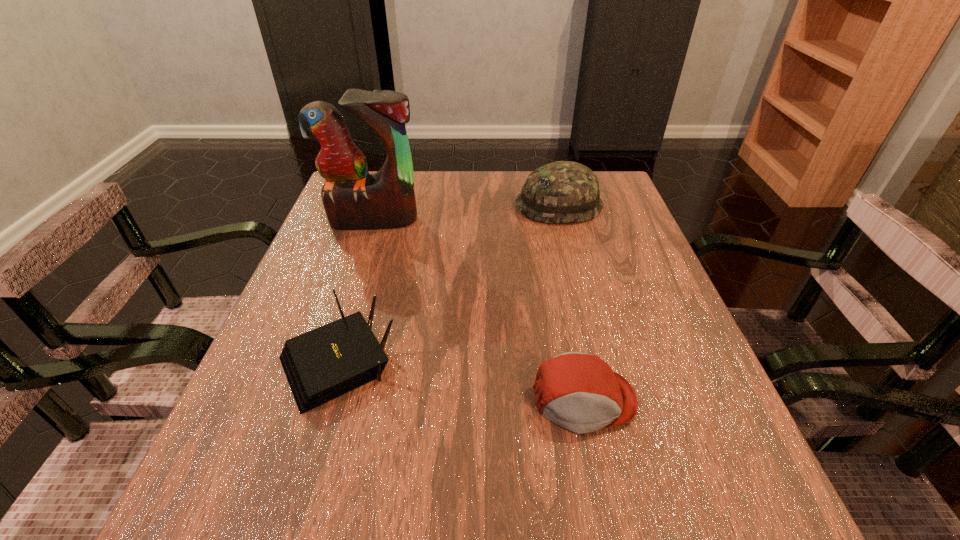
You are a GUI agent. You are given a task and a screenshot of the screen. Output one action in this format:
    pyautogui.click(x=<x>, y=<y>)
    Task: Click on the headwear present at the far edge
    Image resolution: width=960 pixels, height=540 pixels.
    Given the screenshot: What is the action you would take?
    pyautogui.click(x=564, y=191)

Locate an element on the screen. The width and height of the screenshot is (960, 540). parrot present at the left edge is located at coordinates (353, 199).

You are a GUI agent. You are given a task and a screenshot of the screen. Output one action in this format:
    pyautogui.click(x=<x>, y=<y>)
    Task: Click on the router that is at the left edge
    
    Given the screenshot: What is the action you would take?
    pyautogui.click(x=320, y=365)

You are a GUI agent. You are given a task and a screenshot of the screen. Output one action in this format:
    pyautogui.click(x=<x>, y=<y>)
    Task: Click on the object situated at the far left corner
    The height and width of the screenshot is (540, 960).
    Given the screenshot: What is the action you would take?
    pyautogui.click(x=353, y=199)

I want to click on object that is at the far right corner, so click(564, 191).

The width and height of the screenshot is (960, 540). I want to click on vacant space at the far edge, so [516, 197].

I want to click on free region at the near edge of the desktop, so click(x=633, y=506).

Identify the location of vacant space at the right edge of the desktop. The width and height of the screenshot is (960, 540). (648, 294).

What are the coordinates of `vacant area at the far right corner` in the screenshot? It's located at tap(624, 200).

Where is `free spot between the third shortest object and the parrot`? free spot between the third shortest object and the parrot is located at coordinates (466, 213).